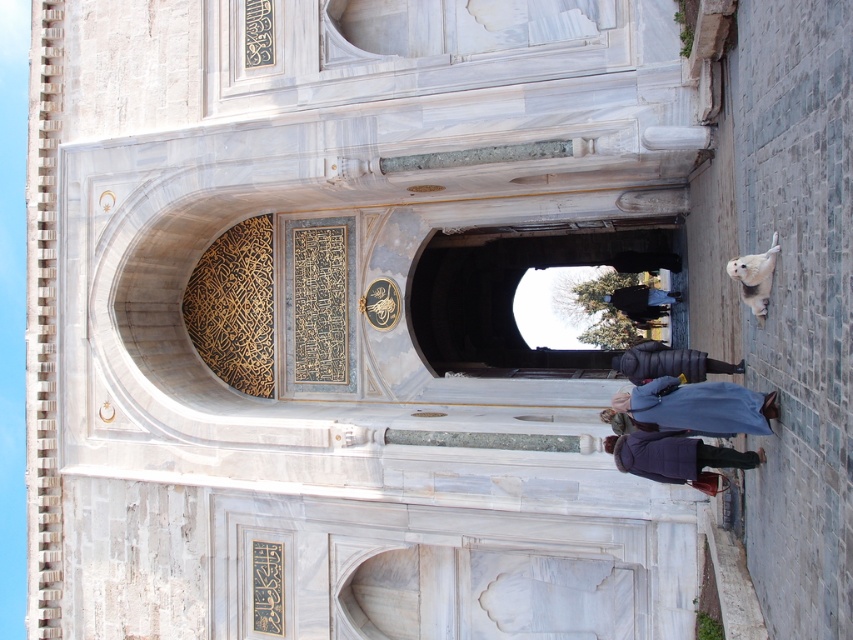
Question: Which point is closer to the camera taking this photo?

Choices:
 (A) (631, 445)
 (B) (728, 381)

Answer: (B)

Question: Is blue wool coat at lower right bigger than dark blue down jacket at lower center?

Choices:
 (A) no
 (B) yes

Answer: (A)

Question: Does blue wool coat at lower right appear over dark blue down jacket at lower center?

Choices:
 (A) no
 (B) yes

Answer: (B)

Question: Among these objects, which one is nearest to the camera?

Choices:
 (A) dark blue down jacket at lower center
 (B) blue wool coat at lower right

Answer: (B)

Question: Among these points, which one is farthest from the camera?

Choices:
 (A) (705, 451)
 (B) (726, 428)

Answer: (A)

Question: Can you confirm if blue wool coat at lower right is positioned to the left of dark blue down jacket at lower center?

Choices:
 (A) yes
 (B) no

Answer: (B)